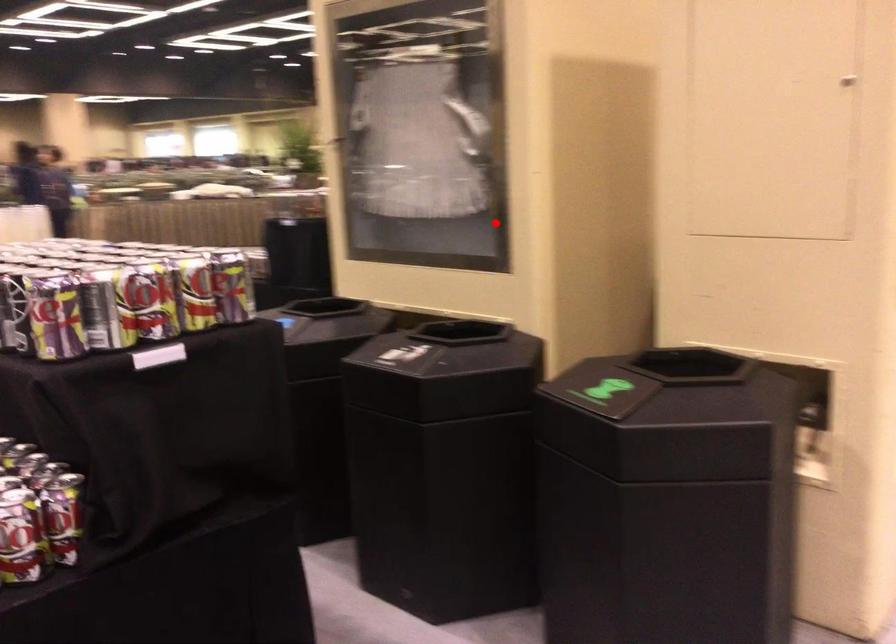
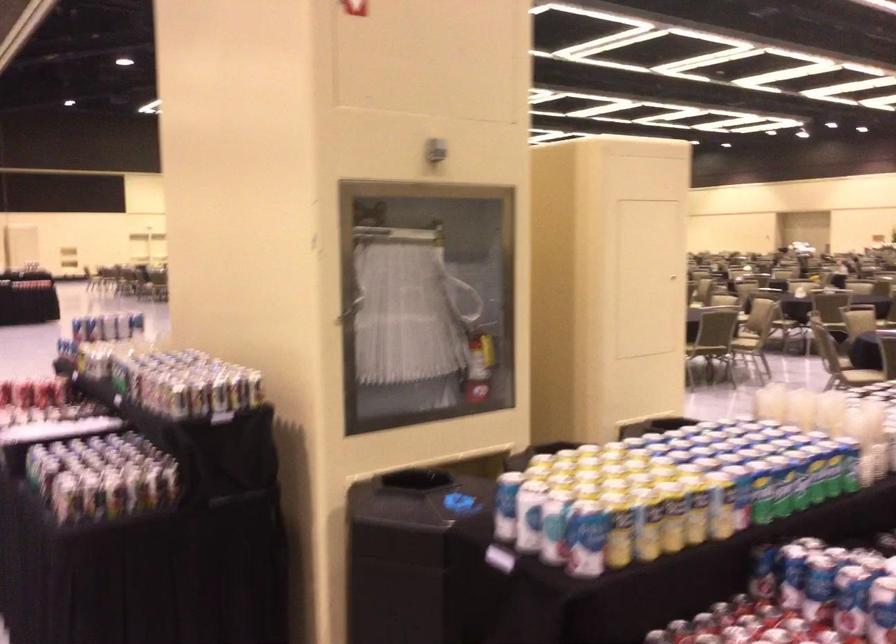
Question: I am providing you with two images of the same scene from different viewpoints. A red point is shown in image1. For the corresponding object point in image2, is it positioned nearer or farther from the camera?

Choices:
 (A) Nearer
 (B) Farther

Answer: (B)